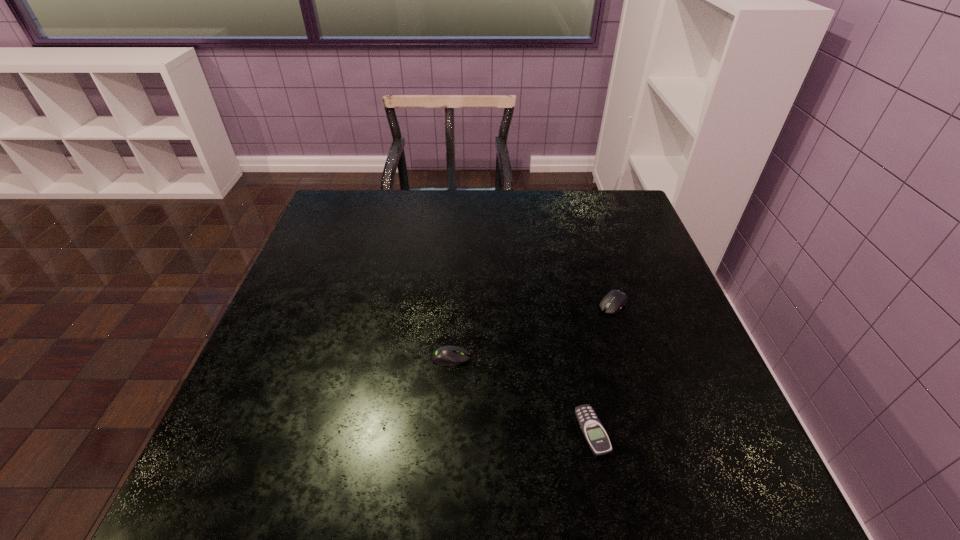
At what (x,y) coordinates should I click in order to perform the action: click on the farthest object. Please return your answer as a coordinate pair (x, y). Looking at the image, I should click on (614, 300).

Where is `the farther computer mouse`? The height and width of the screenshot is (540, 960). the farther computer mouse is located at coordinates (614, 300).

This screenshot has height=540, width=960. I want to click on the leftmost object, so click(447, 355).

You are a GUI agent. You are given a task and a screenshot of the screen. Output one action in this format:
    pyautogui.click(x=<x>, y=<y>)
    Task: Click on the second farthest object
    
    Given the screenshot: What is the action you would take?
    pyautogui.click(x=447, y=355)

Locate an element on the screen. This screenshot has height=540, width=960. the second object from left to right is located at coordinates (594, 433).

Where is `beeper`? The width and height of the screenshot is (960, 540). beeper is located at coordinates (594, 433).

The height and width of the screenshot is (540, 960). Find the location of `vacant space located on the left of the rightmost object`. vacant space located on the left of the rightmost object is located at coordinates (564, 304).

You are a GUI agent. You are given a task and a screenshot of the screen. Output one action in this format:
    pyautogui.click(x=<x>, y=<y>)
    Task: Click on the vacant area situated 0.360m on the wheel side of the nearer computer mouse
    The image size is (960, 540).
    Given the screenshot: What is the action you would take?
    pyautogui.click(x=638, y=358)

Where is `blank space located on the right of the nearest object`? This screenshot has height=540, width=960. blank space located on the right of the nearest object is located at coordinates [710, 431].

This screenshot has height=540, width=960. In order to click on object situated at the near edge in this screenshot , I will do `click(594, 433)`.